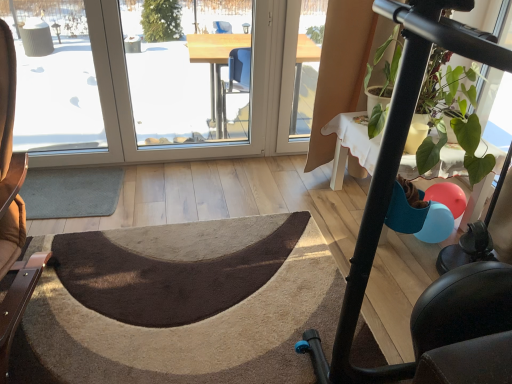
What are the coordinates of `vacant area situated to the left side of white lace tablecloth at upper right` in the screenshot? It's located at (286, 202).